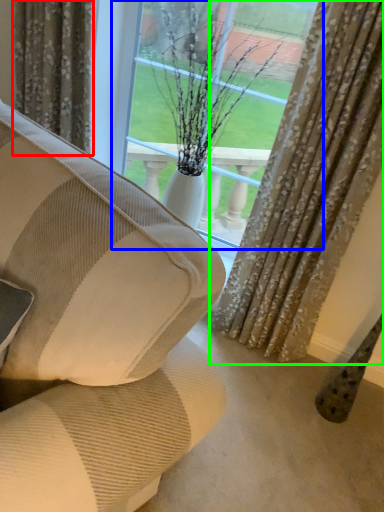
Question: Estimate the real-world distances between objects in this image. Which object is farther from curtain (highlighted by a red box), window (highlighted by a blue box) or curtain (highlighted by a green box)?

Choices:
 (A) window
 (B) curtain

Answer: (B)